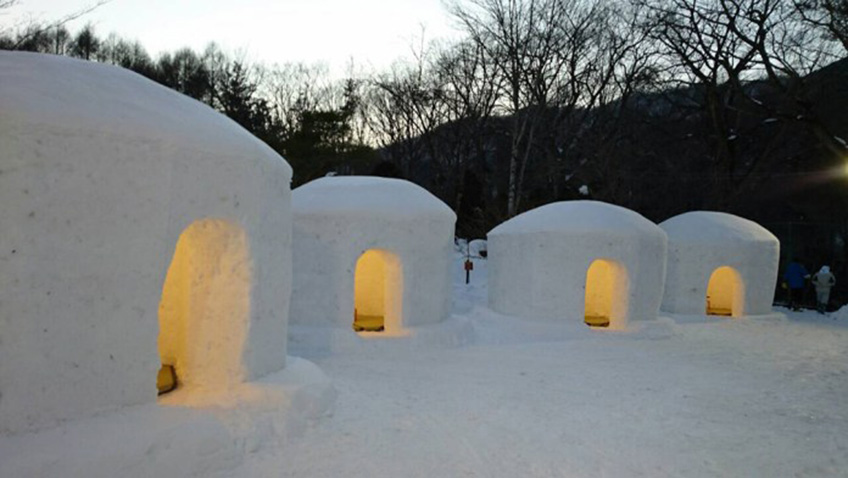
The width and height of the screenshot is (848, 478). I want to click on entrances, so click(x=170, y=309), click(x=377, y=271), click(x=606, y=282), click(x=722, y=296).